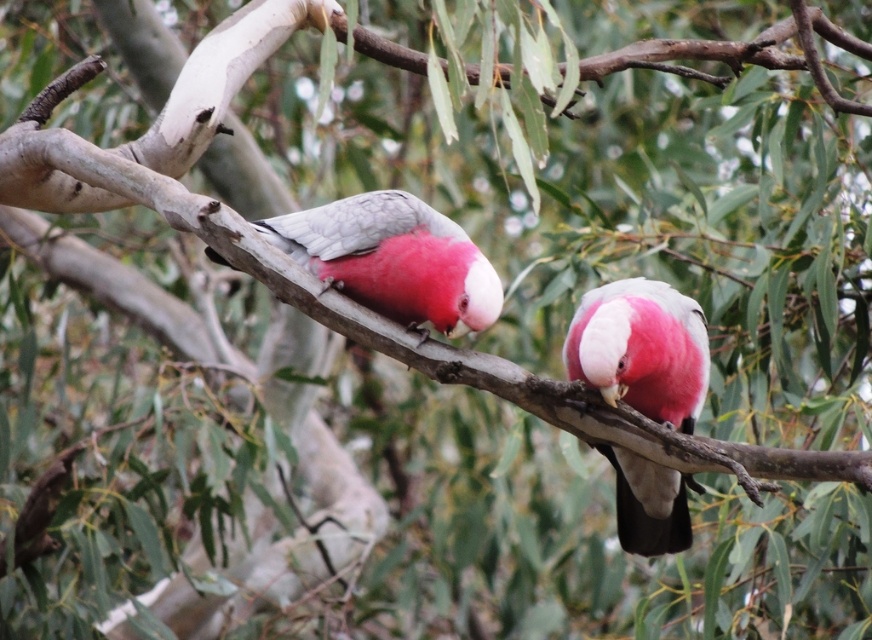
You are a birdwatcher observing two Galahs on a branch. You notice a pink matte parrot at center and a matte pink parrot at center. Which of these two birds is taller?

The pink matte parrot at center is much taller than the matte pink parrot at center.

You are a birdwatcher observing two parrots on a branch. You notice the pink matte parrot at center and the matte pink parrot at center. Which one is closer to you?

The pink matte parrot at center is closer to you because it is in front of the matte pink parrot at center.

You are an ornithologist observing two Galahs on a branch. You notice a pink matte parrot at center and a matte pink parrot at center. Which of these two parrots has a more slender body shape?

The pink matte parrot at center is thinner than the matte pink parrot at center, so it has a more slender body shape.